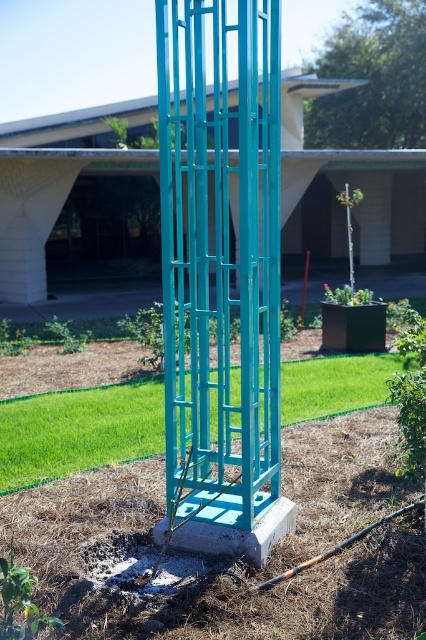
Where is `teal metal trellis at center`? Image resolution: width=426 pixels, height=640 pixels. teal metal trellis at center is located at coordinates (221, 275).

What do you see at coordinates (221, 275) in the screenshot? Image resolution: width=426 pixels, height=640 pixels. I see `teal metal trellis at center` at bounding box center [221, 275].

Between point (268, 16) and point (157, 403), which one is positioned behind?

Positioned behind is point (157, 403).

The width and height of the screenshot is (426, 640). In order to click on teal metal trellis at center in this screenshot , I will do `click(221, 275)`.